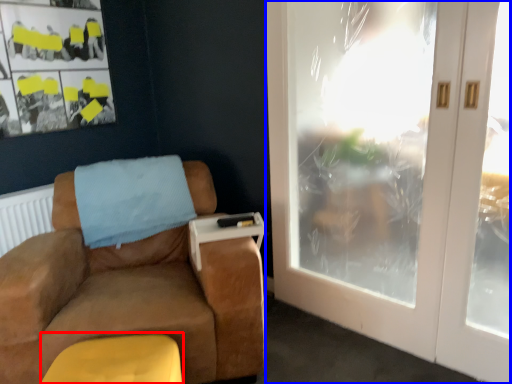
Question: Which object is further to the camera taking this photo, footrest (highlighted by a red box) or door (highlighted by a blue box)?

Choices:
 (A) footrest
 (B) door

Answer: (B)